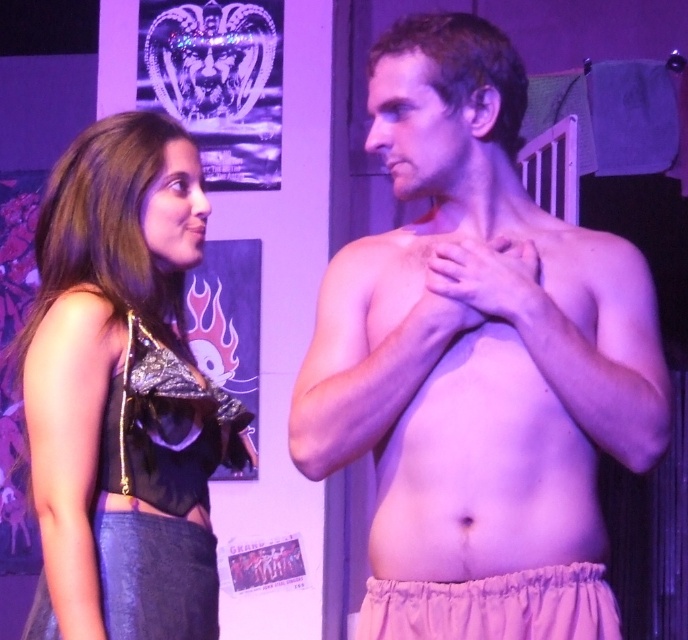
Question: From the image, what is the correct spatial relationship of smooth skin chest at center in relation to elastic white underwear at lower center?

Choices:
 (A) right
 (B) left

Answer: (A)

Question: Is pink fabric shorts at center behind elastic white underwear at lower center?

Choices:
 (A) no
 (B) yes

Answer: (B)

Question: Considering the real-world distances, which object is closest to the shiny black top at left?

Choices:
 (A) smooth skin chest at center
 (B) elastic white underwear at lower center
 (C) pink fabric shorts at center

Answer: (C)

Question: Which object is closer to the camera taking this photo?

Choices:
 (A) smooth skin chest at center
 (B) pink fabric shorts at center

Answer: (B)

Question: Which point appears farthest from the camera in this image?

Choices:
 (A) click(x=539, y=605)
 (B) click(x=495, y=339)
 (C) click(x=160, y=387)
 (D) click(x=400, y=35)

Answer: (C)

Question: Can you confirm if pink fabric shorts at center is positioned to the right of shiny black top at left?

Choices:
 (A) no
 (B) yes

Answer: (B)